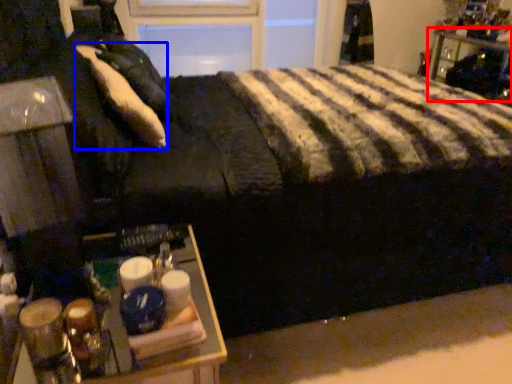
Question: Which of the following is the farthest to the observer, furniture (highlighted by a red box) or pillow (highlighted by a blue box)?

Choices:
 (A) furniture
 (B) pillow

Answer: (A)